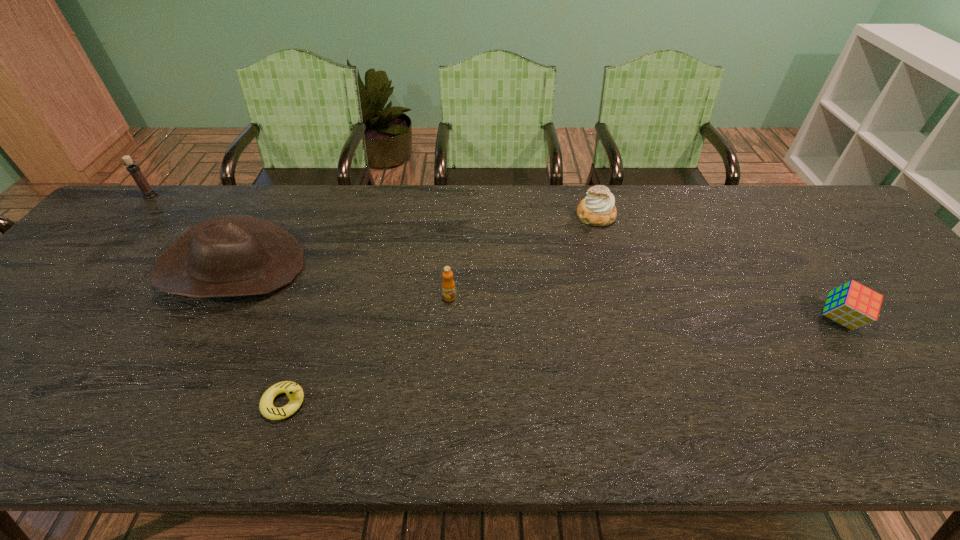
I want to click on vacant space that is in between the orange juice and the cowboy hat, so click(342, 282).

Find the location of a particular element. vacant point located between the third object from right to left and the rightmost object is located at coordinates (644, 308).

The width and height of the screenshot is (960, 540). I want to click on free space between the rightmost object and the fifth object from left to right, so click(718, 267).

Locate an element on the screen. vacant space in between the cowboy hat and the pastry is located at coordinates (415, 242).

The image size is (960, 540). I want to click on unoccupied position between the rightmost object and the cowboy hat, so click(537, 293).

Point out which object is positioned as the second nearest to the pastry. Please provide its 2D coordinates. Your answer should be formatted as a tuple, i.e. [(x, y)], where the tuple contains the x and y coordinates of a point satisfying the conditions above.

[(853, 305)]

Identify which object is the fourth closest to the rightmost object. Please provide its 2D coordinates. Your answer should be formatted as a tuple, i.e. [(x, y)], where the tuple contains the x and y coordinates of a point satisfying the conditions above.

[(229, 255)]

Identify the location of blank space that satisfies the following two spatial constraints: 1. on the front label of the orange juice; 2. on the right side of the rightmost object. Image resolution: width=960 pixels, height=540 pixels. (448, 319).